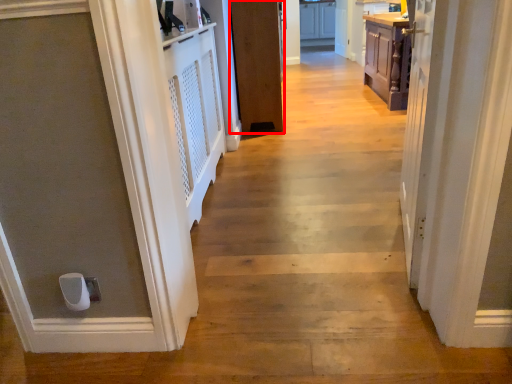
Question: In this image, where is door (annotated by the red box) located relative to cabinetry?

Choices:
 (A) right
 (B) left

Answer: (B)